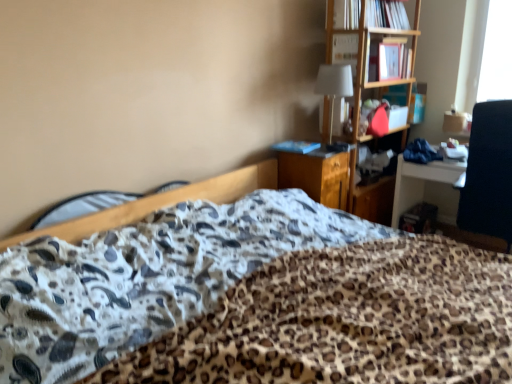
You are a GUI agent. You are given a task and a screenshot of the screen. Output one action in this format:
    pyautogui.click(x=<x>, y=<y>)
    Task: Click on the wooden bed frame at center
    The width and height of the screenshot is (512, 384).
    Given the screenshot: What is the action you would take?
    pyautogui.click(x=160, y=203)

Consider the image. What is the approximate height of white fabric lampshade at upper center?

white fabric lampshade at upper center is 19.42 inches tall.

Describe the element at coordinates (334, 86) in the screenshot. The width and height of the screenshot is (512, 384). I see `white fabric lampshade at upper center` at that location.

This screenshot has width=512, height=384. Identify the location of hardcover book at upper right, which ranks as the 2th book in left-to-right order. (386, 14).

This screenshot has width=512, height=384. I want to click on blue matte book at center, the first book when ordered from bottom to top, so click(296, 146).

Where is `matte pink book at upper right, which is counted as the 2th book, starting from the top`? matte pink book at upper right, which is counted as the 2th book, starting from the top is located at coordinates (389, 59).

Identify the location of wooden bed frame at center. The image size is (512, 384). (160, 203).

From a real-world perspective, which is physically below, blue matte book at center, which is counted as the 3th book, starting from the right, or matte pink book at upper right, which is counted as the 2th book, starting from the top?

blue matte book at center, which is counted as the 3th book, starting from the right, is physically lower.

Is point (285, 151) closer to camera compared to point (401, 39)?

Yes, point (285, 151) is in front of point (401, 39).

Between blue matte book at center, which is counted as the 3th book, starting from the right, and matte pink book at upper right, which is counted as the 2th book, starting from the top, which one is positioned in front?

blue matte book at center, which is counted as the 3th book, starting from the right, is in front.

Which object is wider, blue matte book at center, the third book when ordered from top to bottom, or white fabric lampshade at upper center?

Wider between the two is white fabric lampshade at upper center.

From a real-world perspective, is blue matte book at center, the third book when ordered from top to bottom, located beneath white fabric lampshade at upper center?

Yes.

You are a GUI agent. You are given a task and a screenshot of the screen. Output one action in this format:
    pyautogui.click(x=<x>, y=<y>)
    Task: Click on the table lamp positioned vertically above the blue matte book at center, positioned as the first book in left-to-right order (from a real-world perspective)
    
    Given the screenshot: What is the action you would take?
    pyautogui.click(x=334, y=86)

Is wooden file cabinet at center further to the viewer compared to hardcover book at upper right, the 2th book from the right?

No, wooden file cabinet at center is closer to the viewer.

Can you tell me how much wooden file cabinet at center and hardcover book at upper right, which ranks as the 2th book in left-to-right order, differ in facing direction?

wooden file cabinet at center and hardcover book at upper right, which ranks as the 2th book in left-to-right order, are facing 5.59 degrees away from each other.

Does wooden file cabinet at center have a lesser height compared to hardcover book at upper right, the first book from the top?

In fact, wooden file cabinet at center may be taller than hardcover book at upper right, the first book from the top.

In the scene shown: Measure the distance from blue matte book at center, the first book when ordered from bottom to top, to wooden bed frame at center.

They are 25.10 inches apart.

Considering the relative sizes of blue matte book at center, the first book when ordered from bottom to top, and wooden bed frame at center in the image provided, is blue matte book at center, the first book when ordered from bottom to top, wider than wooden bed frame at center?

Yes, blue matte book at center, the first book when ordered from bottom to top, is wider than wooden bed frame at center.

Would you say blue matte book at center, the third book when ordered from top to bottom, is outside wooden bed frame at center?

Yes, blue matte book at center, the third book when ordered from top to bottom, is outside of wooden bed frame at center.

Based on their sizes in the image, would you say blue matte book at center, which is counted as the 3th book, starting from the right, is bigger or smaller than wooden bed frame at center?

In the image, blue matte book at center, which is counted as the 3th book, starting from the right, appears to be smaller than wooden bed frame at center.

From the image's perspective, relative to wooden bed frame at center, is matte pink book at upper right, the 1th book when ordered from right to left, above or below?

matte pink book at upper right, the 1th book when ordered from right to left, is situated higher than wooden bed frame at center in the image.

Find the location of a particular element. bed frame located on the left of matte pink book at upper right, the 3th book in the left-to-right sequence is located at coordinates (160, 203).

Looking at this image, is matte pink book at upper right, arranged as the 2th book when ordered from the bottom, directly adjacent to wooden bed frame at center?

No, matte pink book at upper right, arranged as the 2th book when ordered from the bottom, is not touching wooden bed frame at center.

Considering the points (392, 76) and (108, 221), which point is in front, point (392, 76) or point (108, 221)?

The point (108, 221) is closer.

Is wooden file cabinet at center oriented towards blue matte book at center, the third book when ordered from top to bottom?

No, wooden file cabinet at center is not facing towards blue matte book at center, the third book when ordered from top to bottom.

Is the surface of wooden file cabinet at center in direct contact with blue matte book at center, positioned as the first book in left-to-right order?

wooden file cabinet at center and blue matte book at center, positioned as the first book in left-to-right order, are not in contact.

From the image's perspective, which is below, wooden file cabinet at center or blue matte book at center, the third book when ordered from top to bottom?

wooden file cabinet at center appears lower in the image.

Considering the relative sizes of wooden file cabinet at center and blue matte book at center, the first book when ordered from bottom to top, in the image provided, is wooden file cabinet at center taller than blue matte book at center, the first book when ordered from bottom to top,?

Yes, wooden file cabinet at center is taller than blue matte book at center, the first book when ordered from bottom to top.

Considering the sizes of hardcover book at upper right, which ranks as the 3th book in bottom-to-top order, and white fabric lampshade at upper center in the image, is hardcover book at upper right, which ranks as the 3th book in bottom-to-top order, wider or thinner than white fabric lampshade at upper center?

Considering their sizes, hardcover book at upper right, which ranks as the 3th book in bottom-to-top order, looks slimmer than white fabric lampshade at upper center.

Is point (356, 0) positioned behind point (347, 83)?

No.

Can we say hardcover book at upper right, the first book from the top, lies outside white fabric lampshade at upper center?

That's correct, hardcover book at upper right, the first book from the top, is outside of white fabric lampshade at upper center.

From a real-world perspective, is hardcover book at upper right, the 2th book from the right, positioned under white fabric lampshade at upper center based on gravity?

Actually, hardcover book at upper right, the 2th book from the right, is physically above white fabric lampshade at upper center in the real world.

You are a GUI agent. You are given a task and a screenshot of the screen. Output one action in this format:
    pyautogui.click(x=<x>, y=<y>)
    Task: Click on the book behind the blue matte book at center, the first book when ordered from bottom to top
    The width and height of the screenshot is (512, 384).
    Given the screenshot: What is the action you would take?
    pyautogui.click(x=389, y=59)

What are the coordinates of `table lamp that appears on the right of blue matte book at center, positioned as the first book in left-to-right order` in the screenshot? It's located at (334, 86).

Considering their positions, is matte pink book at upper right, the 3th book in the left-to-right sequence, positioned closer to blue matte book at center, the third book when ordered from top to bottom, than hardcover book at upper right, which ranks as the 3th book in bottom-to-top order?

The object closer to blue matte book at center, the third book when ordered from top to bottom, is matte pink book at upper right, the 3th book in the left-to-right sequence.

Which object lies further to the anchor point white fabric lampshade at upper center, hardcover book at upper right, the 2th book from the right, or wooden bed frame at center?

wooden bed frame at center is further to white fabric lampshade at upper center.

From the image, which object appears to be farther from matte pink book at upper right, the 3th book in the left-to-right sequence, white fabric lampshade at upper center or wooden bed frame at center?

wooden bed frame at center.

From the image, which object appears to be farther from white fabric lampshade at upper center, hardcover book at upper right, the 2th book from the right, or matte pink book at upper right, the 3th book in the left-to-right sequence?

Among the two, hardcover book at upper right, the 2th book from the right, is located further to white fabric lampshade at upper center.

Based on their spatial positions, is matte pink book at upper right, which is counted as the 2th book, starting from the top, or wooden file cabinet at center further from wooden bed frame at center?

The object further to wooden bed frame at center is matte pink book at upper right, which is counted as the 2th book, starting from the top.

Which object lies further to the anchor point white fabric lampshade at upper center, blue matte book at center, the first book when ordered from bottom to top, or wooden bed frame at center?

The object further to white fabric lampshade at upper center is wooden bed frame at center.

Considering their positions, is wooden file cabinet at center positioned further to matte pink book at upper right, the 1th book when ordered from right to left, than wooden bed frame at center?

wooden bed frame at center lies further to matte pink book at upper right, the 1th book when ordered from right to left, than the other object.

When comparing their distances from wooden bed frame at center, does wooden file cabinet at center or white fabric lampshade at upper center seem further?

Among the two, white fabric lampshade at upper center is located further to wooden bed frame at center.

The width and height of the screenshot is (512, 384). I want to click on table lamp between hardcover book at upper right, the first book from the top, and blue matte book at center, which is counted as the 3th book, starting from the right, in the vertical direction, so click(334, 86).

I want to click on book between hardcover book at upper right, which ranks as the 3th book in bottom-to-top order, and white fabric lampshade at upper center in the up-down direction, so click(389, 59).

Locate an element on the screen. Image resolution: width=512 pixels, height=384 pixels. book between matte pink book at upper right, the 1th book when ordered from right to left, and wooden file cabinet at center vertically is located at coordinates (296, 146).

Locate an element on the screen. book situated between wooden bed frame at center and white fabric lampshade at upper center from left to right is located at coordinates (296, 146).